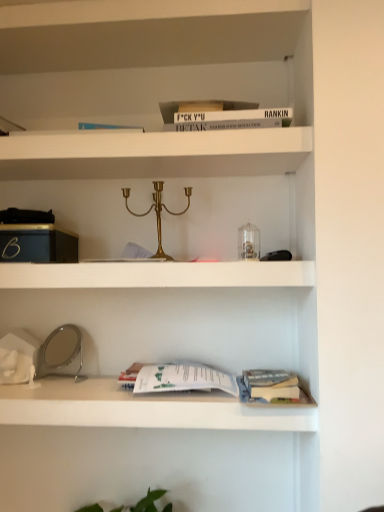
Where is `white paper at lower center, which is counted as the first shelf, starting from the bottom`? white paper at lower center, which is counted as the first shelf, starting from the bottom is located at coordinates (160, 354).

How different are the orientations of white matte shelf at upper center, placed as the 1th shelf when sorted from top to bottom, and white paper at lower center, positioned as the second shelf in top-to-bottom order, in degrees?

There is a 0.000134-degree angle between the facing directions of white matte shelf at upper center, placed as the 1th shelf when sorted from top to bottom, and white paper at lower center, positioned as the second shelf in top-to-bottom order.

Between white matte shelf at upper center, which is the second shelf in bottom-to-top order, and white paper at lower center, positioned as the second shelf in top-to-bottom order, which one has less height?

white matte shelf at upper center, which is the second shelf in bottom-to-top order.

Which is nearer, (x=149, y=39) or (x=200, y=342)?

The point (x=149, y=39) is in front.

Is white matte shelf at upper center, which is the second shelf in bottom-to-top order, inside the boundaries of white paper at lower center, positioned as the second shelf in top-to-bottom order, or outside?

The correct answer is: outside.

Is white matte shelf at center at the right side of white matte shelf at upper center, which is the second shelf in bottom-to-top order?

Yes.

From the image's perspective, between white matte shelf at center and white matte shelf at upper center, placed as the 1th shelf when sorted from top to bottom, who is located below?

white matte shelf at center is shown below in the image.

Based on the photo, who is taller, white matte shelf at center or white matte shelf at upper center, placed as the 1th shelf when sorted from top to bottom?

white matte shelf at center.

Which of these two, white matte shelf at center or white matte shelf at upper center, which is the second shelf in bottom-to-top order, is thinner?

Thinner between the two is white matte shelf at upper center, which is the second shelf in bottom-to-top order.

Can you confirm if white paper at lower center, positioned as the second shelf in top-to-bottom order, is wider than white matte shelf at center?

No, white paper at lower center, positioned as the second shelf in top-to-bottom order, is not wider than white matte shelf at center.

Choose the correct answer: Is white paper at lower center, which is counted as the first shelf, starting from the bottom, inside white matte shelf at center or outside it?

white paper at lower center, which is counted as the first shelf, starting from the bottom, is spatially situated outside white matte shelf at center.

I want to click on shelf below the white matte shelf at center (from the image's perspective), so click(160, 354).

Is white matte shelf at upper center, which is the second shelf in bottom-to-top order, situated inside white matte shelf at center or outside?

white matte shelf at upper center, which is the second shelf in bottom-to-top order, is located beyond the bounds of white matte shelf at center.

From the picture: Considering the relative sizes of white matte shelf at upper center, placed as the 1th shelf when sorted from top to bottom, and white matte shelf at center in the image provided, is white matte shelf at upper center, placed as the 1th shelf when sorted from top to bottom, smaller than white matte shelf at center?

Correct, white matte shelf at upper center, placed as the 1th shelf when sorted from top to bottom, occupies less space than white matte shelf at center.

Is white matte shelf at center turned away from white paper at lower center, positioned as the second shelf in top-to-bottom order?

white matte shelf at center is not turned away from white paper at lower center, positioned as the second shelf in top-to-bottom order.

Between point (36, 279) and point (270, 424), which one is positioned in front?

Positioned in front is point (36, 279).

Which of these two, white matte shelf at center or white paper at lower center, positioned as the second shelf in top-to-bottom order, is wider?

With larger width is white matte shelf at center.

Where is `shelf that appears above the white paper at lower center, positioned as the second shelf in top-to-bottom order (from a real-world perspective)`? This screenshot has width=384, height=512. shelf that appears above the white paper at lower center, positioned as the second shelf in top-to-bottom order (from a real-world perspective) is located at coordinates (150, 58).

Is point (242, 358) more distant than point (118, 44)?

Yes, it is.

Looking at this image, looking at the image, does white paper at lower center, which is counted as the first shelf, starting from the bottom, seem bigger or smaller compared to white matte shelf at upper center, placed as the 1th shelf when sorted from top to bottom?

In the image, white paper at lower center, which is counted as the first shelf, starting from the bottom, appears to be larger than white matte shelf at upper center, placed as the 1th shelf when sorted from top to bottom.

Image resolution: width=384 pixels, height=512 pixels. In order to click on shelf lying above the white paper at lower center, positioned as the second shelf in top-to-bottom order (from the image's perspective) in this screenshot , I will do `click(150, 58)`.

Locate an element on the screen. The width and height of the screenshot is (384, 512). shelf positioned vertically above the white matte shelf at center (from a real-world perspective) is located at coordinates (150, 58).

Based on their spatial positions, is white matte shelf at center or white paper at lower center, positioned as the second shelf in top-to-bottom order, further from white matte shelf at upper center, placed as the 1th shelf when sorted from top to bottom?

white paper at lower center, positioned as the second shelf in top-to-bottom order, is further to white matte shelf at upper center, placed as the 1th shelf when sorted from top to bottom.

When comparing their distances from white matte shelf at center, does white matte shelf at upper center, placed as the 1th shelf when sorted from top to bottom, or white paper at lower center, positioned as the second shelf in top-to-bottom order, seem further?

white matte shelf at upper center, placed as the 1th shelf when sorted from top to bottom, is further to white matte shelf at center.

Estimate the real-world distances between objects in this image. Which object is further from white matte shelf at upper center, which is the second shelf in bottom-to-top order, white paper at lower center, which is counted as the first shelf, starting from the bottom, or white matte shelf at center?

white paper at lower center, which is counted as the first shelf, starting from the bottom, is further to white matte shelf at upper center, which is the second shelf in bottom-to-top order.

From the image, which object appears to be nearer to white paper at lower center, positioned as the second shelf in top-to-bottom order, white matte shelf at upper center, which is the second shelf in bottom-to-top order, or white matte shelf at center?

white matte shelf at center lies closer to white paper at lower center, positioned as the second shelf in top-to-bottom order, than the other object.

In the scene shown: From the image, which object appears to be farther from white matte shelf at center, white paper at lower center, which is counted as the first shelf, starting from the bottom, or white matte shelf at upper center, which is the second shelf in bottom-to-top order?

white matte shelf at upper center, which is the second shelf in bottom-to-top order, is further to white matte shelf at center.

When comparing their distances from white paper at lower center, which is counted as the first shelf, starting from the bottom, does white matte shelf at center or white matte shelf at upper center, placed as the 1th shelf when sorted from top to bottom, seem closer?

white matte shelf at center is closer to white paper at lower center, which is counted as the first shelf, starting from the bottom.

This screenshot has height=512, width=384. Find the location of `cabinet between white matte shelf at upper center, placed as the 1th shelf when sorted from top to bottom, and white paper at lower center, which is counted as the first shelf, starting from the bottom, in the up-down direction`. cabinet between white matte shelf at upper center, placed as the 1th shelf when sorted from top to bottom, and white paper at lower center, which is counted as the first shelf, starting from the bottom, in the up-down direction is located at coordinates (157, 275).